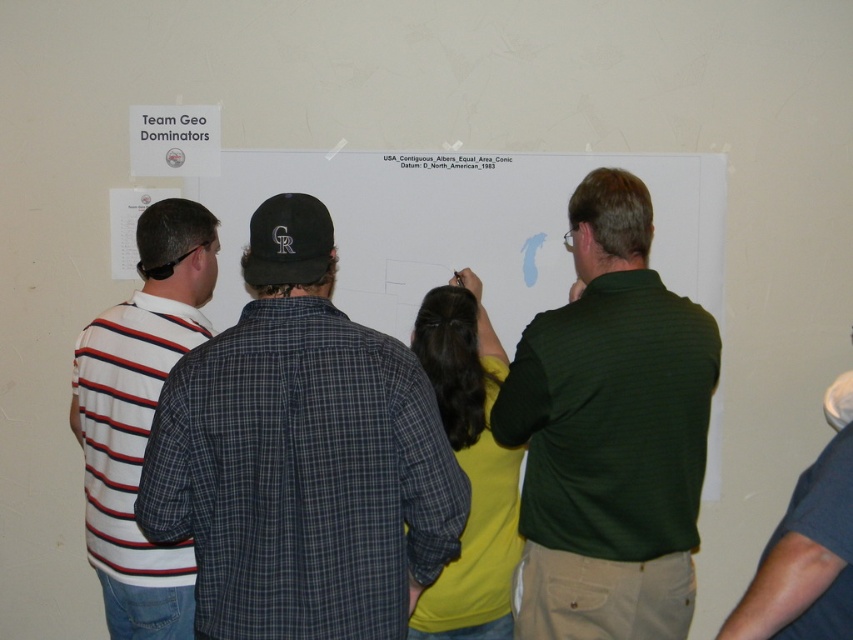
Question: Can you confirm if striped cotton shirt at left is wider than white striped shirt at left?

Choices:
 (A) no
 (B) yes

Answer: (B)

Question: Which object is the farthest from the white paper at upper center?

Choices:
 (A) white paperboard at center
 (B) striped cotton shirt at left
 (C) white striped shirt at left

Answer: (B)

Question: Which of these objects is positioned closest to the white paper at upper center?

Choices:
 (A) green striped polo shirt at center
 (B) striped cotton shirt at left

Answer: (A)

Question: Is the position of green striped polo shirt at center more distant than that of white paperboard at center?

Choices:
 (A) yes
 (B) no

Answer: (B)

Question: Can you confirm if green striped polo shirt at center is positioned above white paperboard at center?

Choices:
 (A) no
 (B) yes

Answer: (A)

Question: Which object is closer to the camera taking this photo?

Choices:
 (A) white paper at upper center
 (B) white striped shirt at left
 (C) white paperboard at center
 (D) striped cotton shirt at left

Answer: (D)